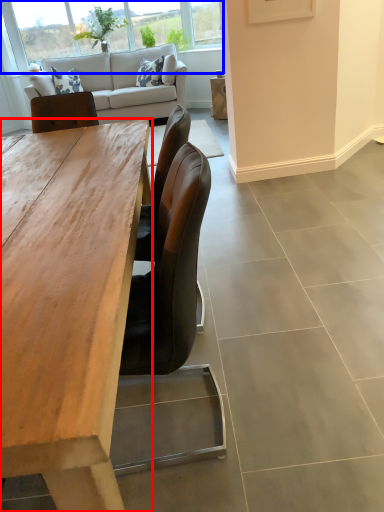
Question: Among these objects, which one is nearest to the camera, desk (highlighted by a red box) or window (highlighted by a blue box)?

Choices:
 (A) desk
 (B) window

Answer: (A)